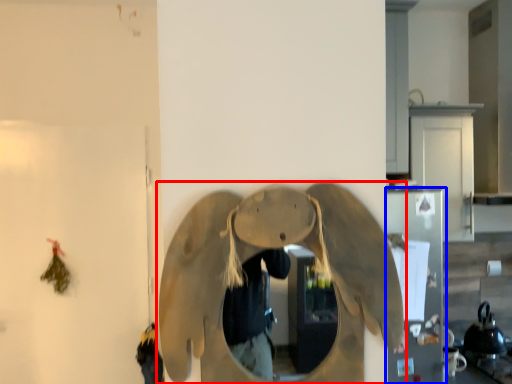
Question: Which object appears farthest to the camera in this image, elephant (highlighted by a red box) or appliance (highlighted by a blue box)?

Choices:
 (A) elephant
 (B) appliance

Answer: (B)